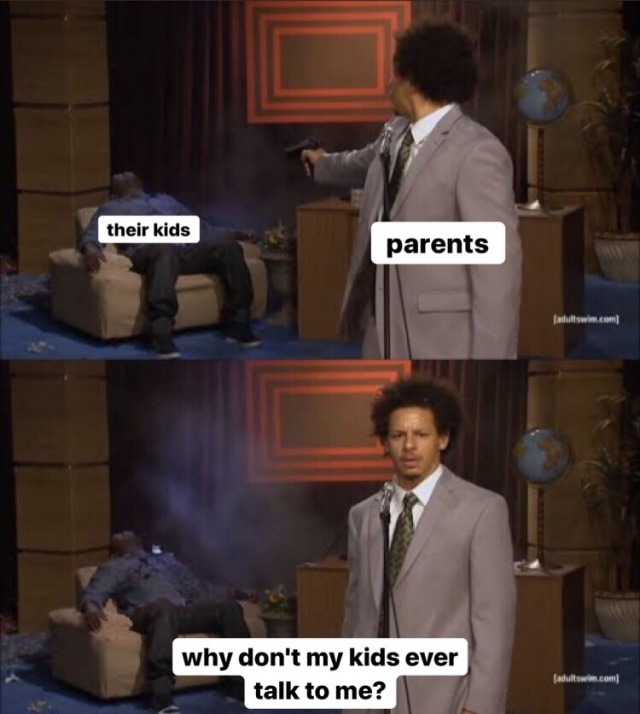
Identify the location of desk. This screenshot has height=714, width=640. (540, 608), (538, 235).